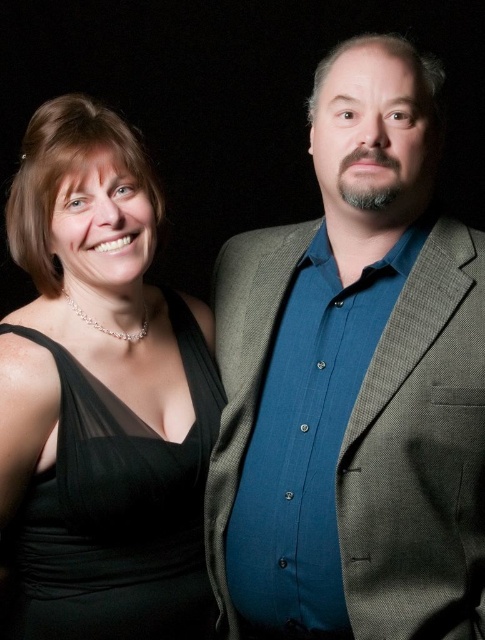
You are organizing a charity event and need to ensure that all donated clothing items fit into storage boxes. The storage box you have can only accommodate items smaller than the black satin dress at left. Will the textured gray blazer at center fit into the box?

The textured gray blazer at center is larger in size than the black satin dress at left, so it will not fit into the storage box designed for items smaller than the black satin dress at left.

You are a photographer setting up for a photoshoot. You have a camera with a 1.5 meter wide frame. You need to position both the textured gray blazer at center and the black satin dress at left within the frame. Can you fit both objects in the frame without moving the camera?

The textured gray blazer at center might be wider than the black satin dress at left, but since the camera frame is 1.5 meters wide, it is possible to fit both objects within the frame as long as their combined width does not exceed 1.5 meters. However, the exact fit depends on the actual widths of the blazer and dress.

You are a photographer setting up for a photoshoot. You have a camera with a 10 inch wide lens. You need to position the camera so that both the textured gray blazer at center and the black satin dress at left are fully in frame. Can you fit both objects within the lens width without moving the camera?

The distance between the textured gray blazer at center and the black satin dress at left is 9.93 inches, which is slightly less than the 10 inch wide lens. Therefore, both objects can fit within the lens width without moving the camera.